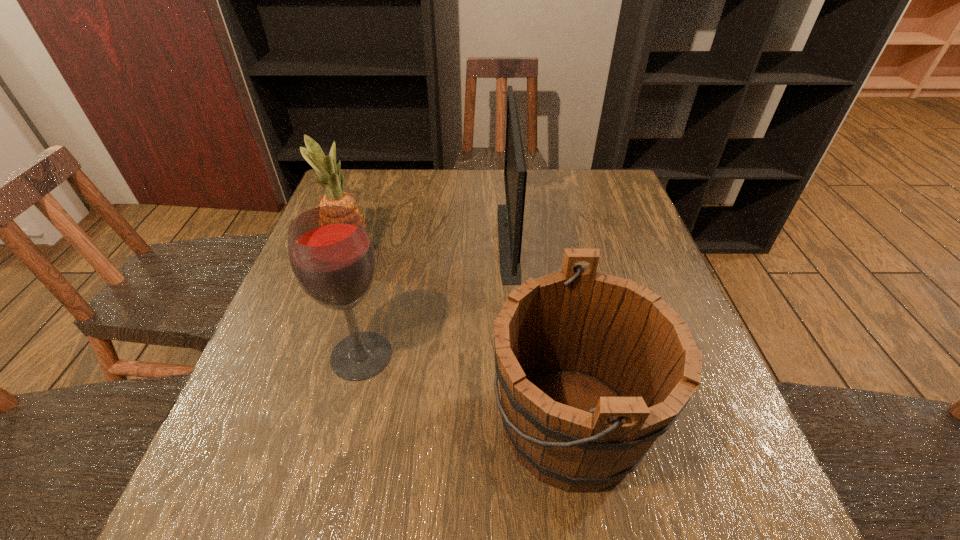
Identify the location of free space at the left edge of the desktop. pos(290,309).

In the image, there is a desktop. Where is `free space at the right edge`? The image size is (960, 540). free space at the right edge is located at coordinates (747, 460).

I want to click on free spot at the far left corner of the desktop, so click(x=369, y=188).

You are a GUI agent. You are given a task and a screenshot of the screen. Output one action in this format:
    pyautogui.click(x=<x>, y=<y>)
    Task: Click on the blank space at the far right corner
    The image size is (960, 540).
    Given the screenshot: What is the action you would take?
    pyautogui.click(x=610, y=176)

This screenshot has height=540, width=960. I want to click on unoccupied area between the alcohol and the monitor, so click(435, 298).

Find the location of `free spot between the monitor and the pineapple`. free spot between the monitor and the pineapple is located at coordinates (428, 246).

Image resolution: width=960 pixels, height=540 pixels. Find the location of `vacant region between the monitor and the alcohol`. vacant region between the monitor and the alcohol is located at coordinates (435, 298).

This screenshot has width=960, height=540. I want to click on free space between the pineapple and the monitor, so [x=428, y=246].

This screenshot has height=540, width=960. In order to click on vacant space that's between the wine bucket and the alcohol in this screenshot , I will do `click(467, 390)`.

Locate an element on the screen. free space between the pineapple and the monitor is located at coordinates 428,246.